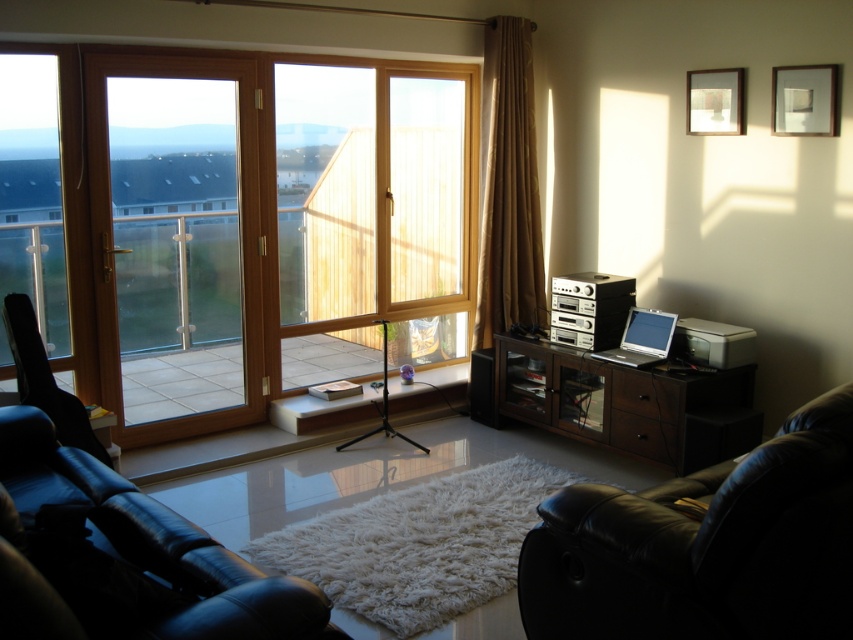
Question: Is dark wood cabinet at center right further to camera compared to black leather armchair at left?

Choices:
 (A) yes
 (B) no

Answer: (A)

Question: Which of the following is the farthest from the observer?

Choices:
 (A) transparent glass door at left
 (B) black leather armchair at left

Answer: (A)

Question: Is transparent glass door at left bigger than silver metallic laptop at right?

Choices:
 (A) no
 (B) yes

Answer: (B)

Question: Which point is closer to the camera?

Choices:
 (A) [x=27, y=385]
 (B) [x=851, y=529]
 (C) [x=126, y=593]
 (D) [x=494, y=280]

Answer: (C)

Question: Based on their relative distances, which object is farther from the dark wood cabinet at center right?

Choices:
 (A) black leather armchair at lower left
 (B) brown fabric curtain at right
 (C) black leather armchair at lower right

Answer: (A)

Question: From the image, what is the correct spatial relationship of black leather armchair at lower right in relation to transparent glass window at left?

Choices:
 (A) below
 (B) above

Answer: (A)